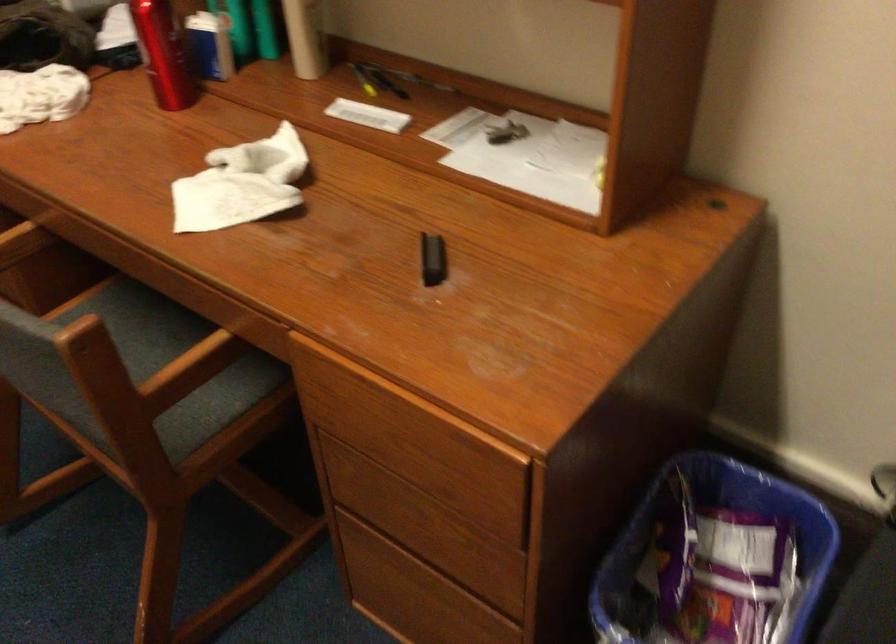
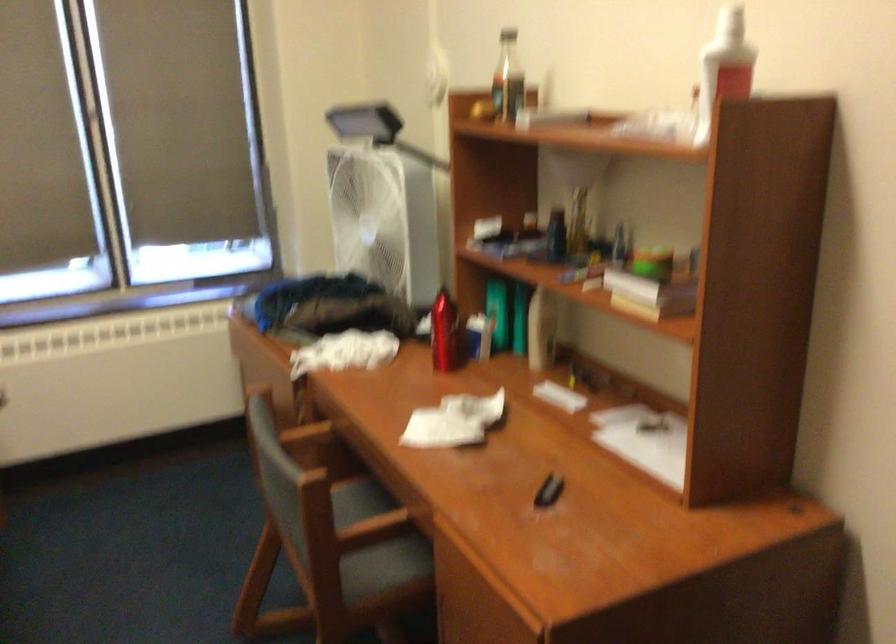
In the second image, find the point that corresponds to (x=196, y=383) in the first image.

(375, 545)